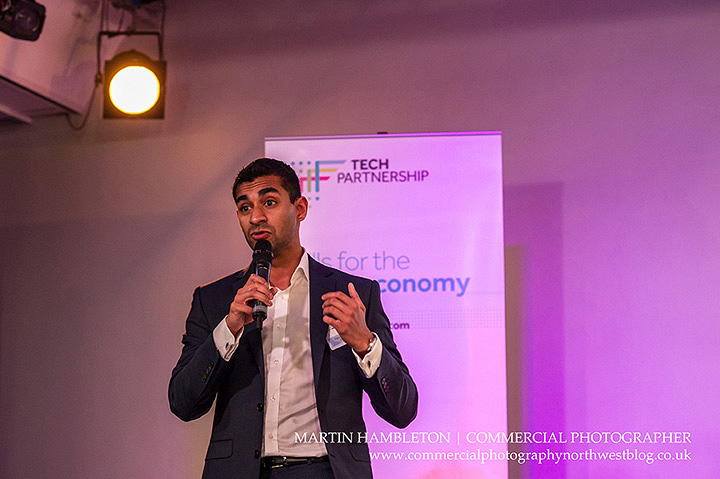
You are a GUI agent. You are given a task and a screenshot of the screen. Output one action in this format:
    pyautogui.click(x=<x>, y=<y>)
    Task: Click on the white wall with pink and orange lights
    This screenshot has height=479, width=720.
    Given the screenshot: What is the action you would take?
    pyautogui.click(x=156, y=194)